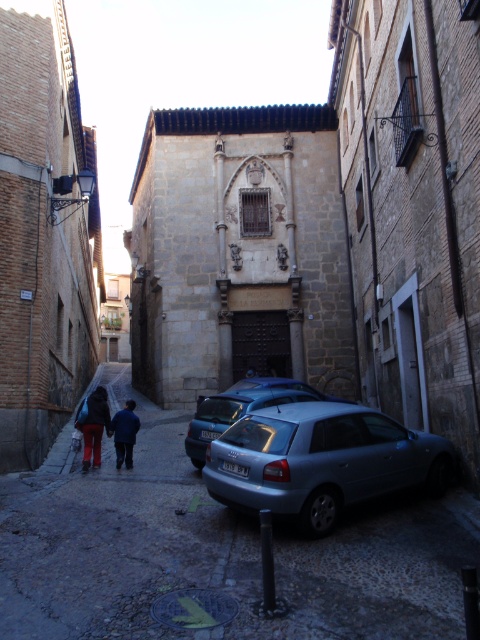
You are standing at the point marked as point (241, 408) in the image. What object is located exactly at that point?

The metallic silver car at center is located exactly at point (241, 408).

You are driving a car and want to park it in the narrow cobblestone street shown in the image. The parking spot is marked by the point at coordinates (215, 550). Can you safely park your car there without blocking the entrance of the central building?

The point at coordinates (215, 550) indicates a silver metallic car at center, so parking there would mean placing your car where the existing silver metallic car at center is located, potentially blocking the entrance of the central building.

You are a delivery person needing to park your metallic silver car at center in a spot that can accommodate its size. There is a blue fabric jacket at center currently occupying the space. Can the jacket be moved to make room for the car?

The metallic silver car at center is larger than the blue fabric jacket at center, so the jacket can be moved to make room for the car.